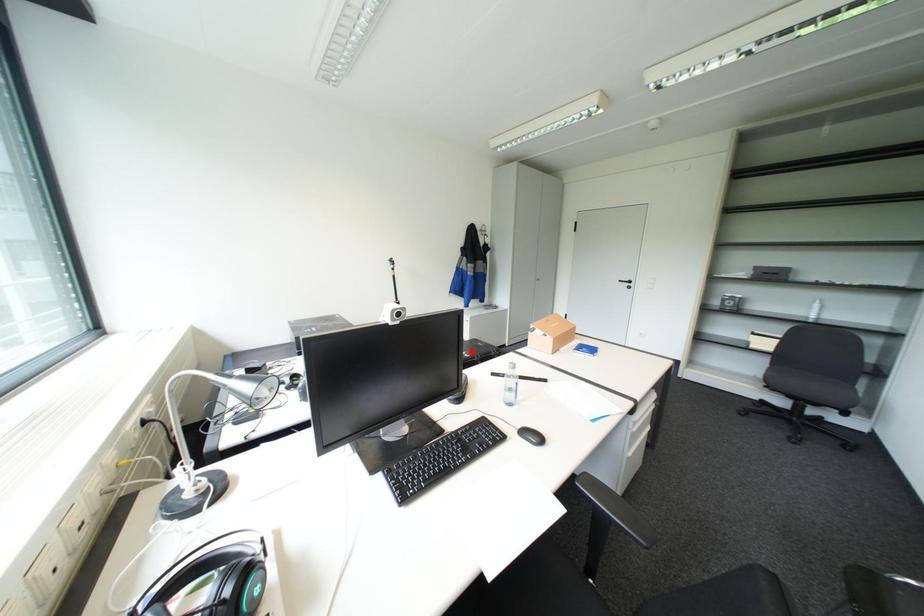
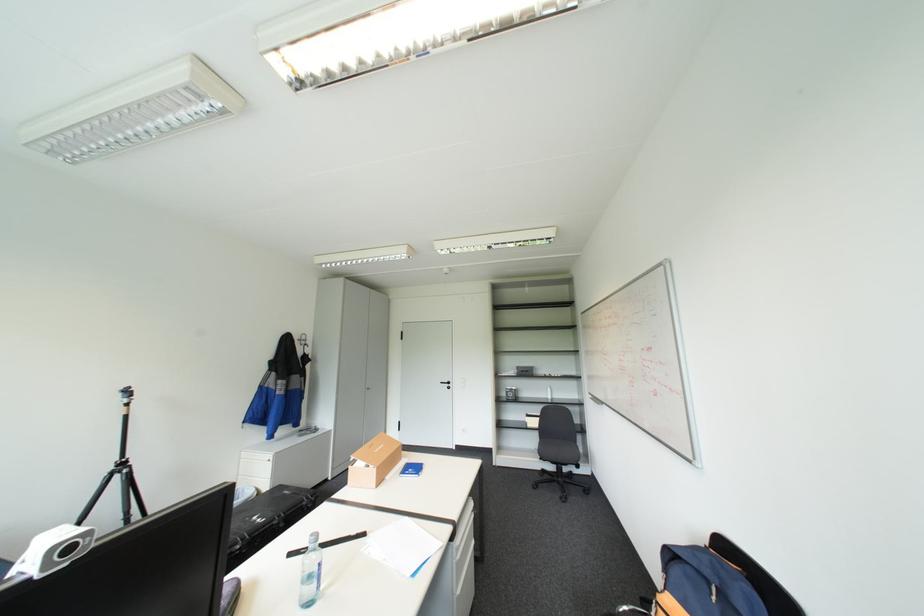
The point at the highlighted location is marked in the first image. Where is the corresponding point in the second image?

(262, 517)